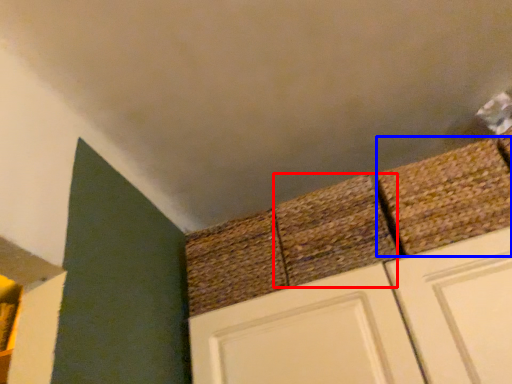
Question: Which object appears closest to the camera in this image, brick (highlighted by a red box) or brick (highlighted by a blue box)?

Choices:
 (A) brick
 (B) brick

Answer: (B)